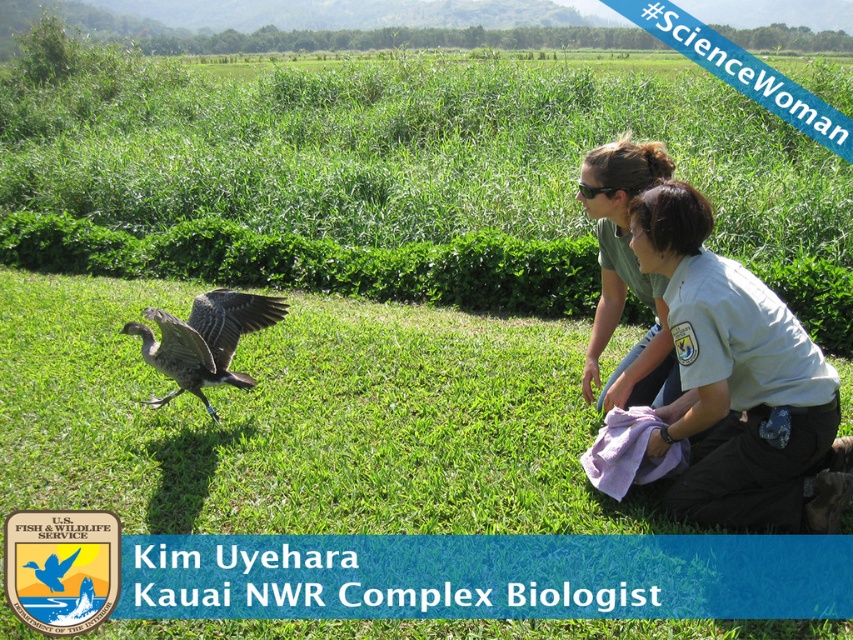
You are a visitor at Kauai NWR Complex and want to approach the two biologists observing the goose. Which of the two, the light gray uniform at center or the green matte shirt at center, should you approach first based on their position?

You should approach the light gray uniform at center first because it is closer to you than the green matte shirt at center.

You are a visitor at Kauai NWR Complex and notice two biologists observing a goose. You see the green matte shirt at center and the gray feathered goose at center. Which object is located to the right of the other?

The green matte shirt at center is positioned on the right side of gray feathered goose at center.